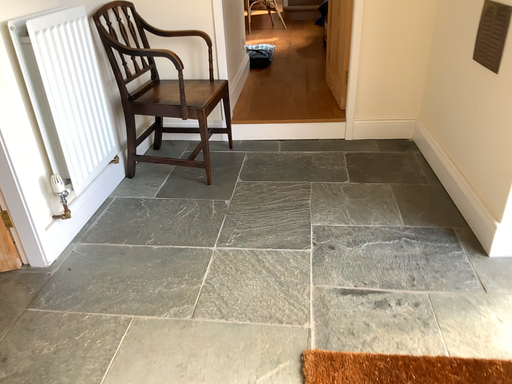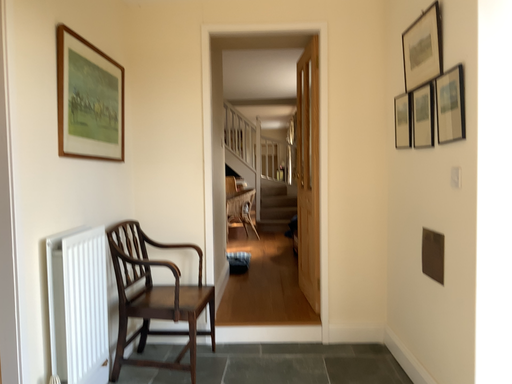
Question: How did the camera likely rotate when shooting the video?

Choices:
 (A) rotated downward
 (B) rotated upward

Answer: (B)